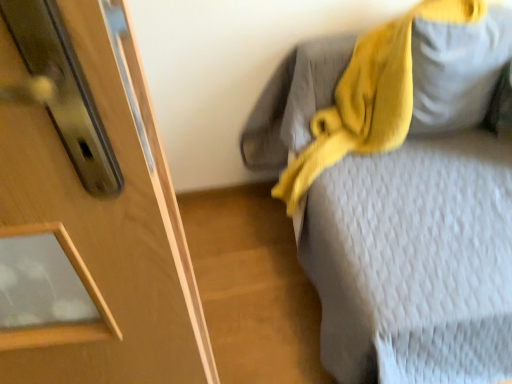
Question: Would you consider textured gray bed at upper right to be distant from matte gray pillow at upper right?

Choices:
 (A) yes
 (B) no

Answer: (B)

Question: Can you confirm if textured gray bed at upper right is taller than matte gray pillow at upper right?

Choices:
 (A) yes
 (B) no

Answer: (A)

Question: Is textured gray bed at upper right turned away from matte gray pillow at upper right?

Choices:
 (A) yes
 (B) no

Answer: (A)

Question: Can you confirm if textured gray bed at upper right is smaller than matte gray pillow at upper right?

Choices:
 (A) no
 (B) yes

Answer: (A)

Question: From the image's perspective, is textured gray bed at upper right below matte gray pillow at upper right?

Choices:
 (A) yes
 (B) no

Answer: (A)

Question: Choose the correct answer: Is textured gray bed at upper right inside yellow knitted scarf at upper right or outside it?

Choices:
 (A) outside
 (B) inside

Answer: (A)

Question: In terms of height, does textured gray bed at upper right look taller or shorter compared to yellow knitted scarf at upper right?

Choices:
 (A) short
 (B) tall

Answer: (B)

Question: From the image's perspective, is textured gray bed at upper right located above or below yellow knitted scarf at upper right?

Choices:
 (A) above
 (B) below

Answer: (B)

Question: Looking at their shapes, would you say textured gray bed at upper right is wider or thinner than yellow knitted scarf at upper right?

Choices:
 (A) thin
 (B) wide

Answer: (B)

Question: Is matte gray pillow at upper right taller or shorter than yellow knitted scarf at upper right?

Choices:
 (A) tall
 (B) short

Answer: (B)

Question: Would you say matte gray pillow at upper right is to the left or to the right of yellow knitted scarf at upper right in the picture?

Choices:
 (A) right
 (B) left

Answer: (A)

Question: In terms of size, does matte gray pillow at upper right appear bigger or smaller than yellow knitted scarf at upper right?

Choices:
 (A) small
 (B) big

Answer: (A)

Question: Considering the positions of point (480, 84) and point (345, 100), is point (480, 84) closer or farther from the camera than point (345, 100)?

Choices:
 (A) farther
 (B) closer

Answer: (B)

Question: Is point (424, 34) closer or farther from the camera than point (330, 347)?

Choices:
 (A) farther
 (B) closer

Answer: (A)

Question: From a real-world perspective, is matte gray pillow at upper right positioned above or below textured gray bed at upper right?

Choices:
 (A) below
 (B) above

Answer: (B)